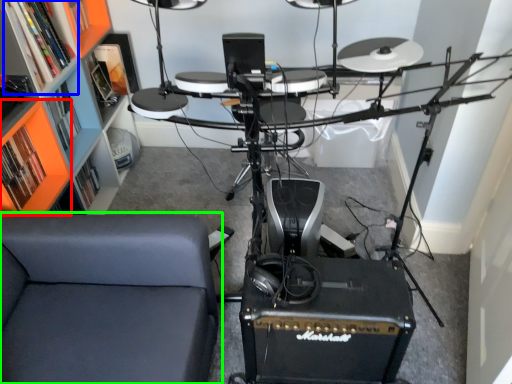
Question: Estimate the real-world distances between objects in this image. Which object is farther from shelf (highlighted by a red box), shelf (highlighted by a blue box) or furniture (highlighted by a green box)?

Choices:
 (A) shelf
 (B) furniture

Answer: (B)